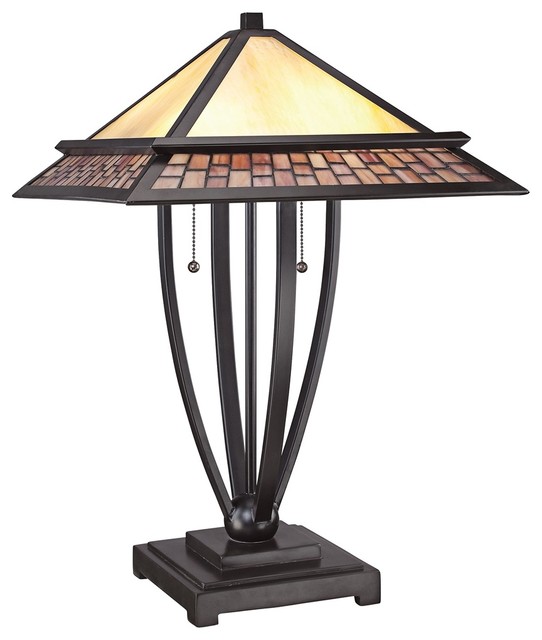
Image resolution: width=542 pixels, height=640 pixels. Identify the location of stand. (329, 564).